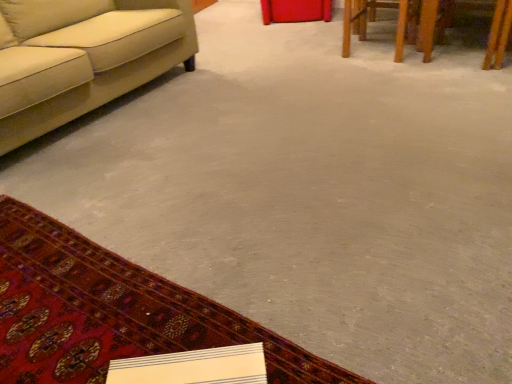
This screenshot has height=384, width=512. I want to click on wooden table at upper right, so click(397, 24).

This screenshot has height=384, width=512. I want to click on carpeted mat at lower left, so click(x=112, y=312).

Is point (136, 24) positioned after point (348, 40)?

No, it is in front of (348, 40).

From a real-world perspective, is beige fabric couch at left physically above wooden table at upper right?

Yes, from a real-world perspective, beige fabric couch at left is over wooden table at upper right

Can you confirm if beige fabric couch at left is smaller than wooden table at upper right?

Actually, beige fabric couch at left might be larger than wooden table at upper right.

Relative to wooden table at upper right, is beige fabric couch at left in front or behind?

beige fabric couch at left is in front of wooden table at upper right.

In terms of height, does wooden table at upper right look taller or shorter compared to carpeted mat at lower left?

Clearly, wooden table at upper right is taller compared to carpeted mat at lower left.

From the image's perspective, would you say wooden table at upper right is positioned over carpeted mat at lower left?

Indeed, from the image's perspective, wooden table at upper right is shown above carpeted mat at lower left.

Would you say carpeted mat at lower left is part of wooden table at upper right's contents?

No, carpeted mat at lower left is not surrounded by wooden table at upper right.

Looking at this image, how many degrees apart are the facing directions of wooden table at upper right and carpeted mat at lower left?

2.25 degrees separate the facing orientations of wooden table at upper right and carpeted mat at lower left.

Locate an element on the screen. This screenshot has height=384, width=512. table below the beige fabric couch at left (from a real-world perspective) is located at coordinates (397, 24).

Between wooden table at upper right and beige fabric couch at left, which one is positioned in front?

beige fabric couch at left is in front.

Is wooden table at upper right not inside beige fabric couch at left?

That's correct, wooden table at upper right is outside of beige fabric couch at left.

From a real-world perspective, does wooden table at upper right sit lower than beige fabric couch at left?

Yes, from a real-world perspective, wooden table at upper right is under beige fabric couch at left.

Would you say carpeted mat at lower left contains beige fabric couch at left?

Definitely not — beige fabric couch at left is not inside carpeted mat at lower left.

Identify the location of mat on the right of beige fabric couch at left. (112, 312).

Between carpeted mat at lower left and beige fabric couch at left, which one has smaller size?

With smaller size is carpeted mat at lower left.

Is beige fabric couch at left smaller than carpeted mat at lower left?

Actually, beige fabric couch at left might be larger than carpeted mat at lower left.

From the image's perspective, is beige fabric couch at left located above carpeted mat at lower left?

Yes, from the image's perspective, beige fabric couch at left is on top of carpeted mat at lower left.

Which object is more forward, beige fabric couch at left or carpeted mat at lower left?

carpeted mat at lower left.

Is carpeted mat at lower left facing away from wooden table at upper right?

carpeted mat at lower left is not turned away from wooden table at upper right.

Looking at this image, from a real-world perspective, relative to wooden table at upper right, is carpeted mat at lower left vertically above or below?

carpeted mat at lower left is situated lower than wooden table at upper right in the real world.

Would you say carpeted mat at lower left is to the left or to the right of wooden table at upper right in the picture?

In the image, carpeted mat at lower left appears on the left side of wooden table at upper right.

Looking at this image, which is farther from the camera, (22, 215) or (357, 12)?

The point (357, 12) is more distant.

Locate an element on the screen. Image resolution: width=512 pixels, height=384 pixels. table behind the beige fabric couch at left is located at coordinates (x=397, y=24).

The image size is (512, 384). I want to click on table above the carpeted mat at lower left (from the image's perspective), so click(x=397, y=24).

Looking at the image, which one is located closer to beige fabric couch at left, carpeted mat at lower left or wooden table at upper right?

carpeted mat at lower left.

Which object lies nearer to the anchor point beige fabric couch at left, wooden table at upper right or carpeted mat at lower left?

carpeted mat at lower left is positioned closer to the anchor beige fabric couch at left.

Considering their positions, is carpeted mat at lower left positioned further to wooden table at upper right than beige fabric couch at left?

carpeted mat at lower left.

Based on their spatial positions, is beige fabric couch at left or carpeted mat at lower left further from wooden table at upper right?

Based on the image, carpeted mat at lower left appears to be further to wooden table at upper right.

Looking at the image, which one is located closer to carpeted mat at lower left, wooden table at upper right or beige fabric couch at left?

beige fabric couch at left is closer to carpeted mat at lower left.

Which object lies nearer to the anchor point carpeted mat at lower left, beige fabric couch at left or wooden table at upper right?

beige fabric couch at left lies closer to carpeted mat at lower left than the other object.

This screenshot has width=512, height=384. In order to click on mat between beige fabric couch at left and wooden table at upper right in the horizontal direction in this screenshot , I will do `click(112, 312)`.